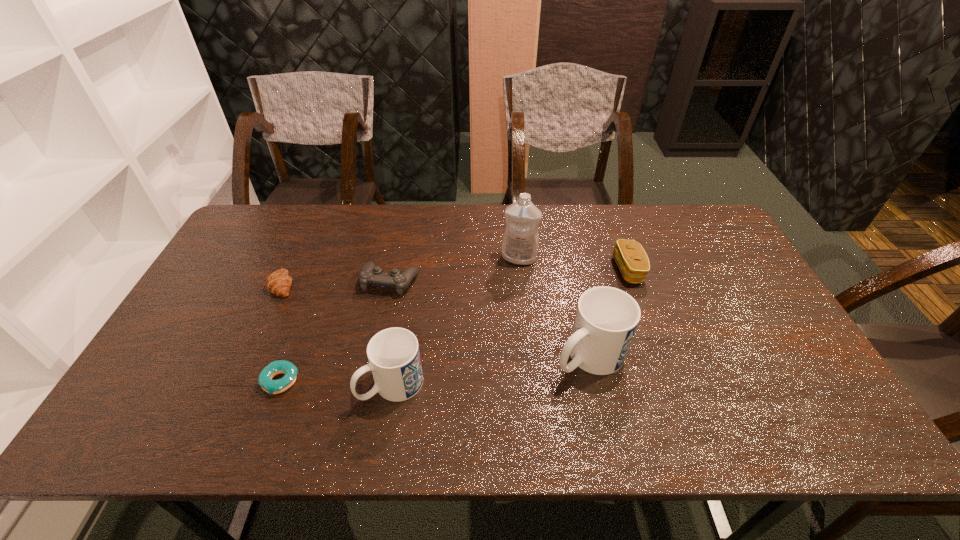
Identify the location of the third tallest object. This screenshot has height=540, width=960. (394, 359).

Find the location of a particular element. This screenshot has height=540, width=960. the shorter mug is located at coordinates (394, 359).

I want to click on the taller mug, so [606, 319].

The image size is (960, 540). I want to click on the sixth object from left to right, so click(x=606, y=319).

Identify the location of the leftmost object. This screenshot has width=960, height=540. (279, 282).

The width and height of the screenshot is (960, 540). I want to click on crescent roll, so click(x=279, y=282).

Image resolution: width=960 pixels, height=540 pixels. What are the coordinates of `control` in the screenshot? It's located at pyautogui.click(x=370, y=274).

Find the location of a particular element. This screenshot has width=960, height=540. the third object from right to left is located at coordinates (520, 242).

The image size is (960, 540). In order to click on the tallest object in this screenshot , I will do `click(520, 242)`.

Identify the location of the fourth shortest object. (632, 260).